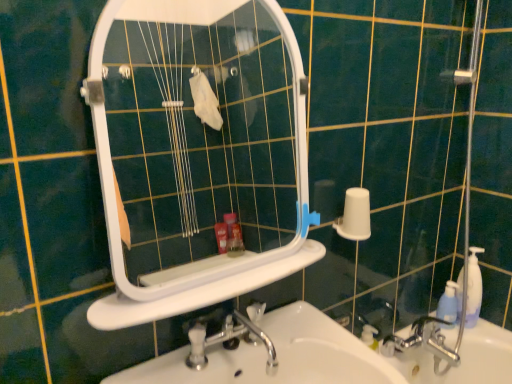
Question: Should I look upward or downward to see white matte toilet paper at right?

Choices:
 (A) up
 (B) down

Answer: (B)

Question: Can you confirm if white plastic ledge at center is shorter than white glossy sink at lower center?

Choices:
 (A) no
 (B) yes

Answer: (B)

Question: Is white plastic ledge at center facing away from white glossy sink at lower center?

Choices:
 (A) no
 (B) yes

Answer: (A)

Question: Does white plastic ledge at center appear on the left side of white glossy sink at lower center?

Choices:
 (A) yes
 (B) no

Answer: (A)

Question: From a real-world perspective, is white plastic ledge at center below white glossy sink at lower center?

Choices:
 (A) yes
 (B) no

Answer: (B)

Question: Is white plastic ledge at center facing towards white glossy sink at lower center?

Choices:
 (A) yes
 (B) no

Answer: (B)

Question: Is white plastic ledge at center bigger than white glossy sink at lower center?

Choices:
 (A) yes
 (B) no

Answer: (B)

Question: Is blue translucent bottle at right wider than white matte toilet paper at right?

Choices:
 (A) yes
 (B) no

Answer: (B)

Question: Is blue translucent bottle at right positioned with its back to white matte toilet paper at right?

Choices:
 (A) yes
 (B) no

Answer: (B)

Question: Is blue translucent bottle at right in front of white matte toilet paper at right?

Choices:
 (A) no
 (B) yes

Answer: (A)

Question: From the image's perspective, is blue translucent bottle at right beneath white matte toilet paper at right?

Choices:
 (A) no
 (B) yes

Answer: (B)

Question: From the image's perspective, is blue translucent bottle at right on top of white matte toilet paper at right?

Choices:
 (A) no
 (B) yes

Answer: (A)

Question: Is blue translucent bottle at right to the right of white matte toilet paper at right from the viewer's perspective?

Choices:
 (A) no
 (B) yes

Answer: (B)

Question: From the image's perspective, is blue translucent bottle at right over white plastic mirror at upper center?

Choices:
 (A) no
 (B) yes

Answer: (A)